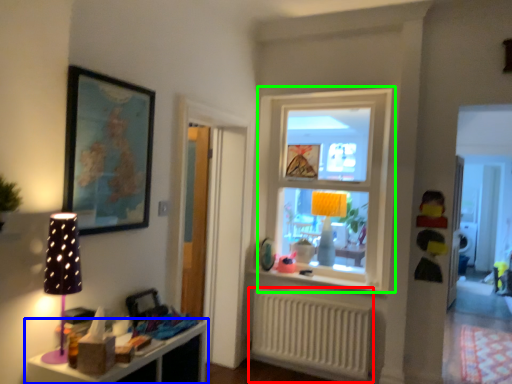
Question: Considering the real-world distances, which object is closest to radiator (highlighted by a red box)? shelf (highlighted by a blue box) or window (highlighted by a green box).

Choices:
 (A) shelf
 (B) window

Answer: (B)